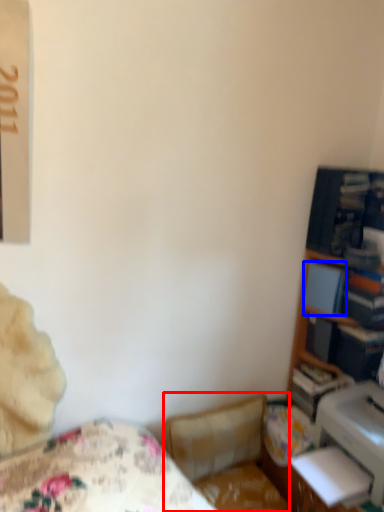
Question: Which point is closer to the camera, swivel chair (highlighted by a red box) or paperback book (highlighted by a blue box)?

Choices:
 (A) swivel chair
 (B) paperback book

Answer: (A)